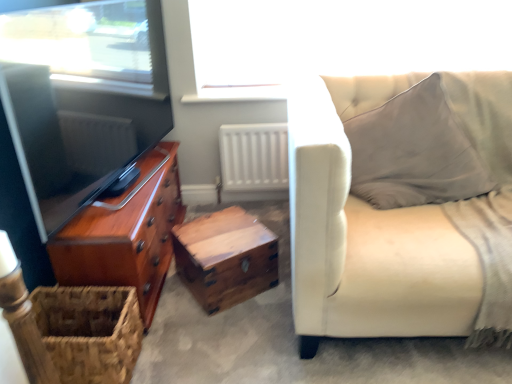
I want to click on vacant space in white matte radiator at center (from a real-world perspective), so click(252, 195).